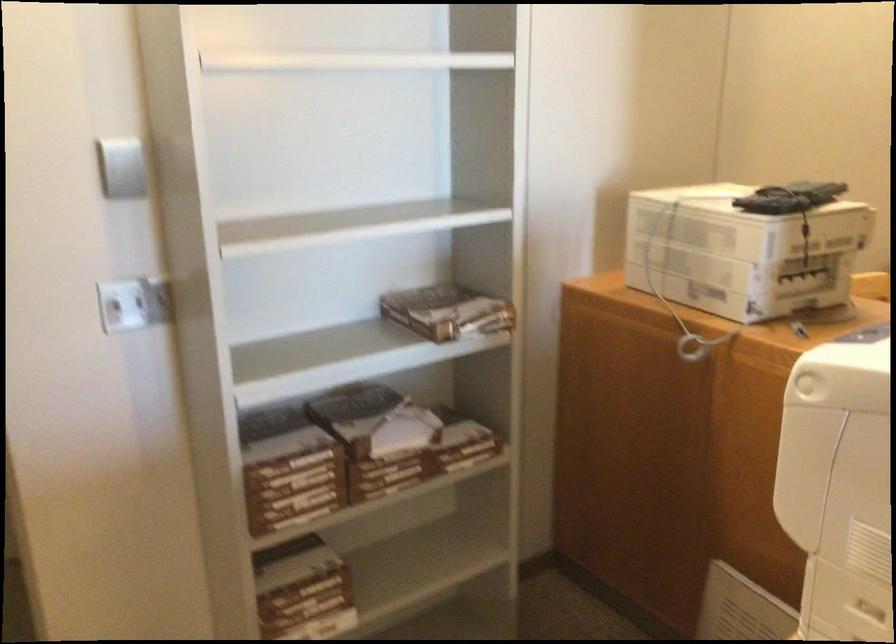
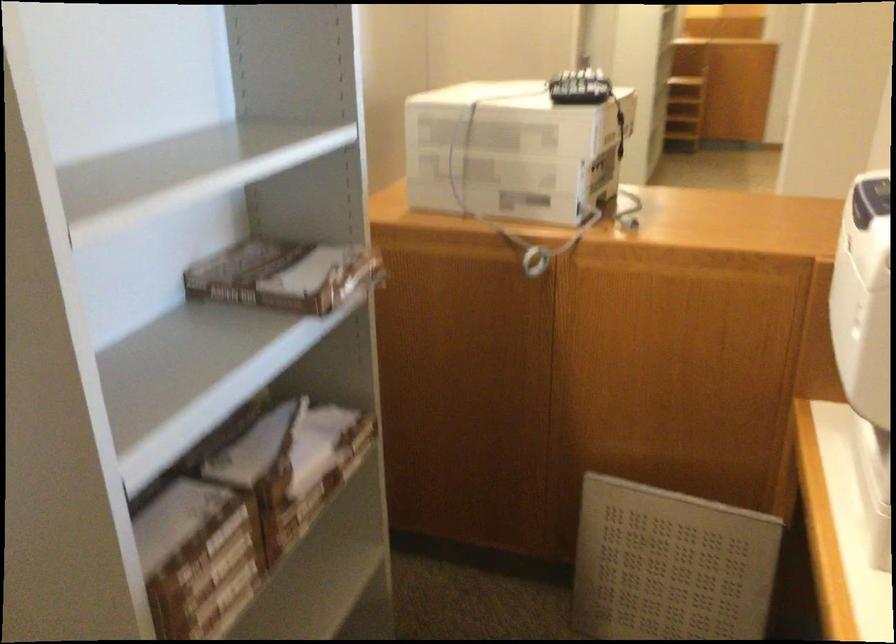
In the second image, find the point that corresponds to (769,193) in the first image.

(580, 87)